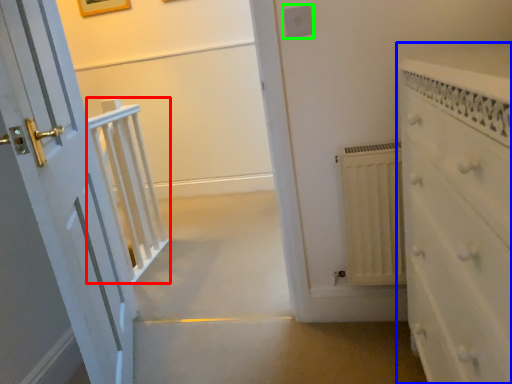
Question: Estimate the real-world distances between objects in this image. Which object is farther from balustrade (highlighted by a red box), chest of drawers (highlighted by a blue box) or electric outlet (highlighted by a green box)?

Choices:
 (A) chest of drawers
 (B) electric outlet

Answer: (A)